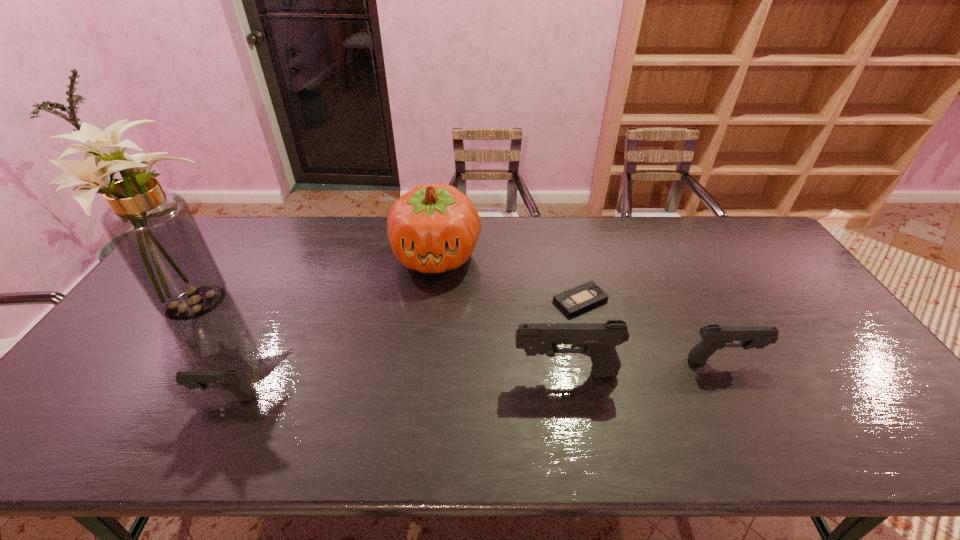
You are a GUI agent. You are given a task and a screenshot of the screen. Output one action in this format:
    pyautogui.click(x=<x>, y=<y>)
    Task: Click on the videotape
    This screenshot has height=540, width=960.
    Given the screenshot: What is the action you would take?
    (573, 301)

Identify the location of free space located at the barrel of the shortest pistol. The width and height of the screenshot is (960, 540). (80, 398).

Where is `vacant space situated 0.110m at the barrel of the shortest pistol`? The height and width of the screenshot is (540, 960). vacant space situated 0.110m at the barrel of the shortest pistol is located at coordinates (147, 398).

The image size is (960, 540). Find the location of `free spot located at the barrel of the shortest pistol`. free spot located at the barrel of the shortest pistol is located at coordinates (63, 398).

What are the coordinates of `free space located at the barrel of the second pistol from left to right` in the screenshot? It's located at (422, 373).

Locate an element on the screen. free region located 0.080m at the barrel of the second pistol from left to right is located at coordinates (x=482, y=373).

Locate an element on the screen. The width and height of the screenshot is (960, 540). free space located at the barrel of the second pistol from left to right is located at coordinates (466, 373).

You are a GUI agent. You are given a task and a screenshot of the screen. Output one action in this format:
    pyautogui.click(x=<x>, y=<y>)
    Task: Click on the vacant space located at the barrel of the fourth tallest object
    
    Given the screenshot: What is the action you would take?
    [x=783, y=361]

Where is `free space located on the side of the fourth object from right to left with the cute face`? This screenshot has height=540, width=960. free space located on the side of the fourth object from right to left with the cute face is located at coordinates (420, 397).

This screenshot has height=540, width=960. I want to click on free space located on the back of the flower arrangement, so click(230, 256).